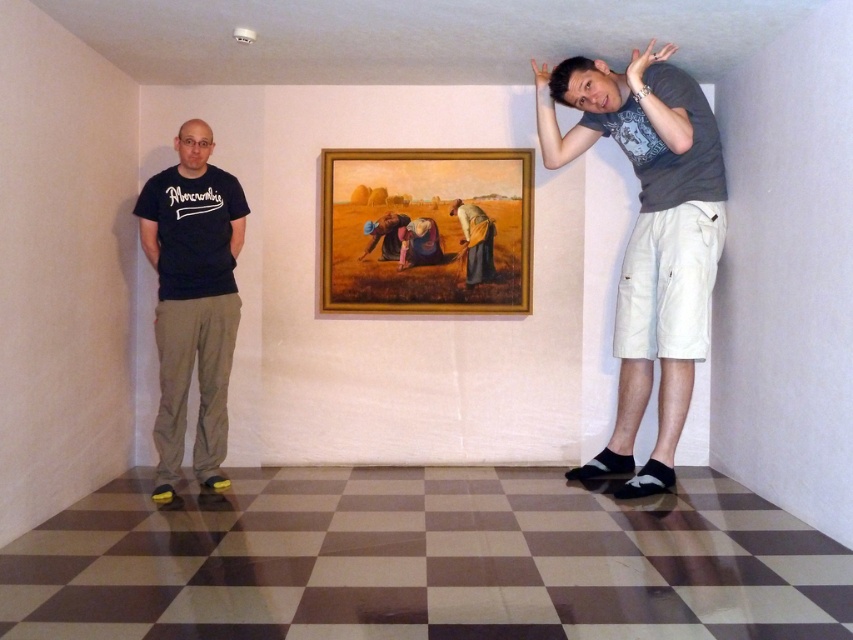
You are standing in the room and want to walk to the framed painting hanging between two people. Which point, point (346, 177) or point (469, 205), is closer to the framed painting?

Point (469, 205) is closer to the framed painting because it is in front of point (346, 177).